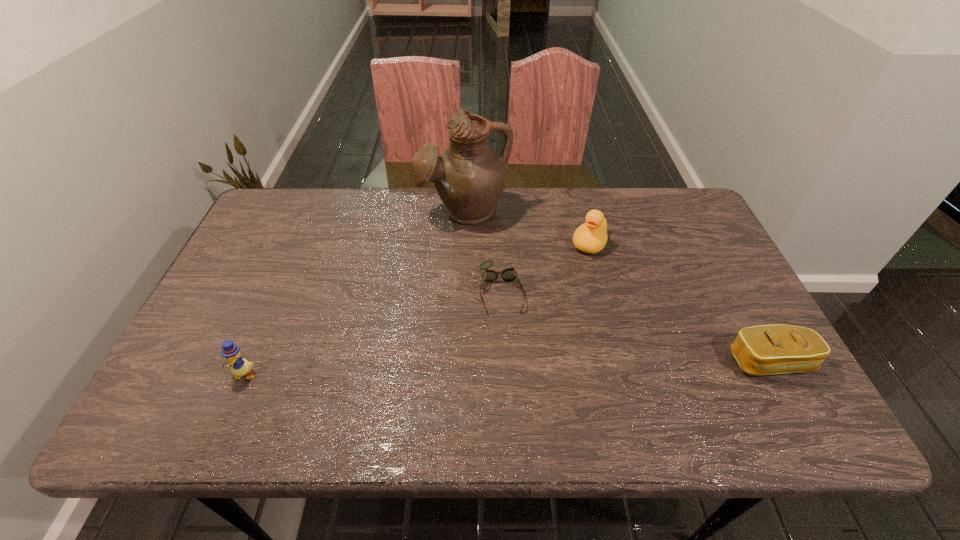
What are the coordinates of `vacant space on the desktop that is between the duckling and the rightmost object and is positioned at the spout of the pitcher` in the screenshot? It's located at coord(469,369).

Image resolution: width=960 pixels, height=540 pixels. I want to click on vacant space on the desktop that is between the leftmost object and the second shortest object and is positioned on the face of the duck, so click(x=527, y=367).

You are a GUI agent. You are given a task and a screenshot of the screen. Output one action in this format:
    pyautogui.click(x=<x>, y=<y>)
    Task: Click on the vacant space on the desktop that is between the leftmost object and the fourth tallest object and is positioned on the front-facing side of the third nearest object
    This screenshot has width=960, height=540.
    Given the screenshot: What is the action you would take?
    pyautogui.click(x=513, y=368)